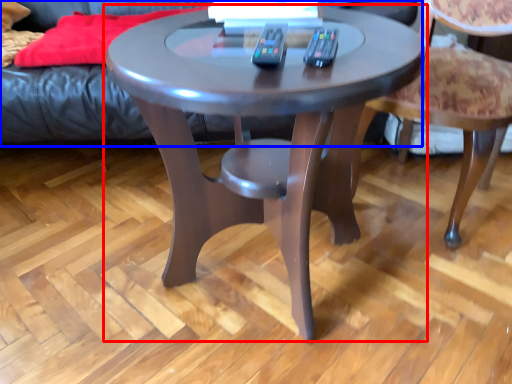
Question: Which point is closer to the camera, coffee table (highlighted by a red box) or couch (highlighted by a blue box)?

Choices:
 (A) coffee table
 (B) couch

Answer: (A)